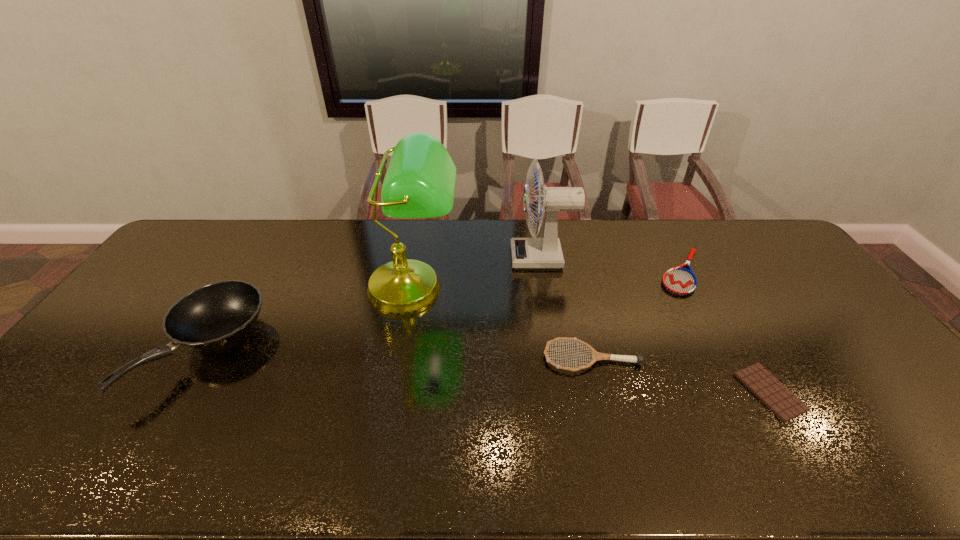
Image resolution: width=960 pixels, height=540 pixels. Find the location of `vacant space that satisfies the following two spatial constraints: 1. on the front-facing side of the second tallest object; 2. on the front side of the leftmost object`. vacant space that satisfies the following two spatial constraints: 1. on the front-facing side of the second tallest object; 2. on the front side of the leftmost object is located at coordinates (558, 350).